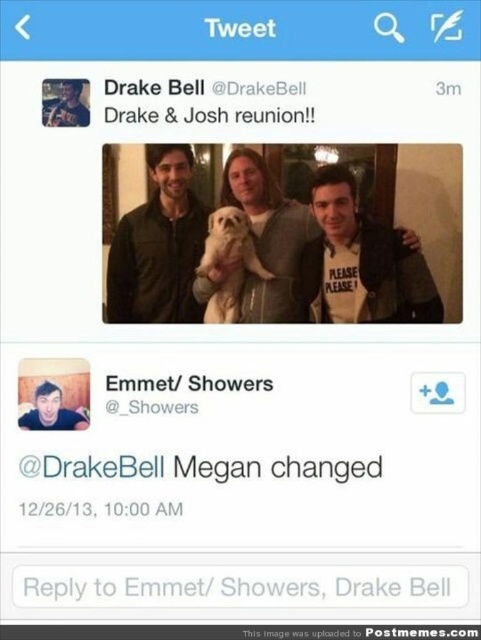
Locate an element on the screen. matte black jacket at center is located at coordinates (364, 260).

Locate an element on the screen. matte black jacket at center is located at coordinates (364, 260).

Is point (387, 294) behind point (217, 212)?

No, (387, 294) is closer to viewer.

Who is more distant from viewer, [390,320] or [235,307]?

The point [235,307] is behind.

Measure the distance between matte black jacket at center and camera.

matte black jacket at center is 4.78 feet away from camera.

Where is `matte black jacket at center`? matte black jacket at center is located at coordinates (364, 260).

Is matte green jacket at center further to camera compared to matte skin face at center?

That is True.

Can you confirm if matte green jacket at center is positioned to the right of matte skin face at center?

Yes, matte green jacket at center is to the right of matte skin face at center.

Is point (119, 314) less distant than point (49, 412)?

No, it is not.

I want to click on matte green jacket at center, so pyautogui.click(x=159, y=246).